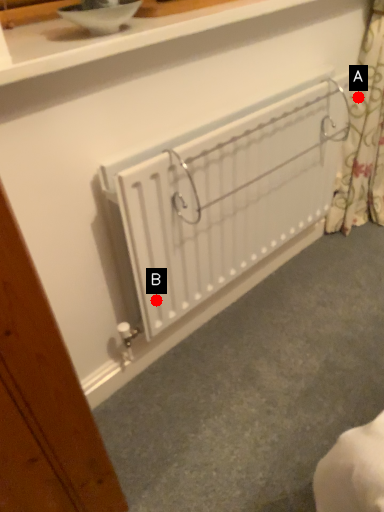
Question: Two points are circled on the image, labeled by A and B beside each circle. Which point appears closest to the camera in this image?

Choices:
 (A) A is closer
 (B) B is closer

Answer: (B)